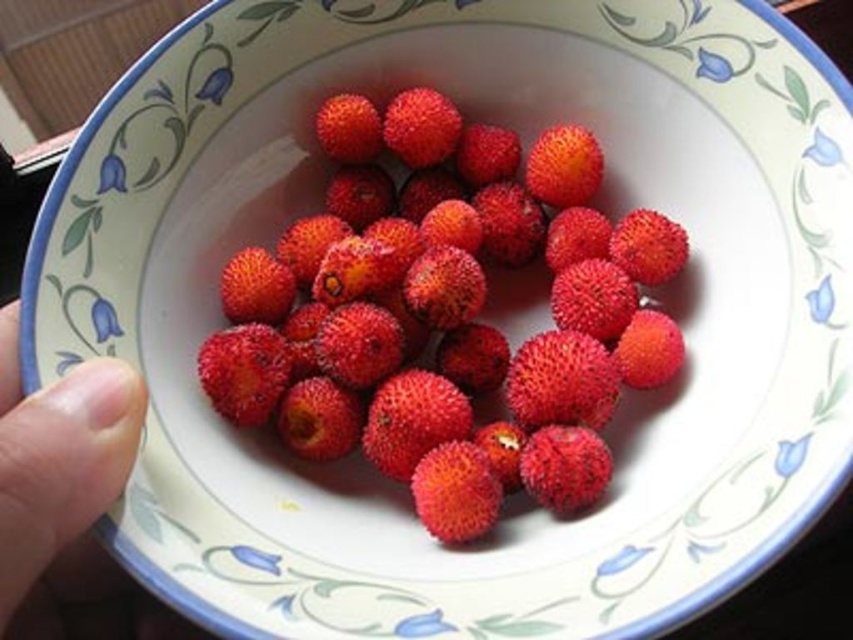
Question: Is spongy red berries at center bigger than smooth skin finger at lower left?

Choices:
 (A) yes
 (B) no

Answer: (A)

Question: Which point is farther from the camera taking this photo?

Choices:
 (A) (263, 280)
 (B) (131, 612)

Answer: (A)

Question: Does spongy red berries at center appear over smooth skin finger at lower left?

Choices:
 (A) yes
 (B) no

Answer: (A)

Question: Does spongy red berries at center appear on the right side of smooth skin finger at lower left?

Choices:
 (A) yes
 (B) no

Answer: (A)